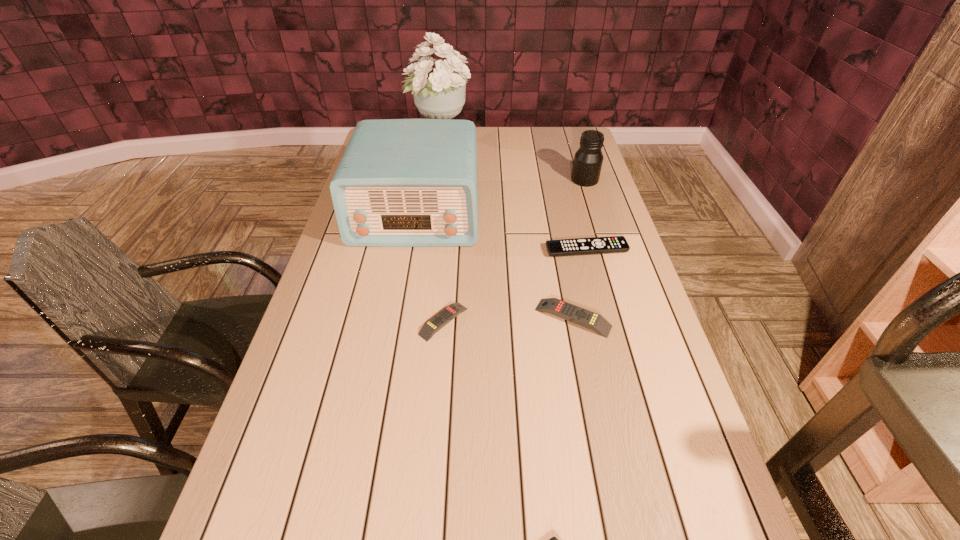
Locate an element on the screen. vacant point that satisfies the following two spatial constraints: 1. on the front panel of the bigger yellow remote control; 2. on the right side of the sixth shortest object is located at coordinates (398, 318).

Where is `free region that satisfies the following two spatial constraints: 1. on the front side of the farthest remote control; 2. on the left side of the green bouquet`? free region that satisfies the following two spatial constraints: 1. on the front side of the farthest remote control; 2. on the left side of the green bouquet is located at coordinates pyautogui.click(x=425, y=249).

Where is `vacant region that satisfies the following two spatial constraints: 1. on the front panel of the right yellow remote control; 2. on the left side of the second tallest object`? vacant region that satisfies the following two spatial constraints: 1. on the front panel of the right yellow remote control; 2. on the left side of the second tallest object is located at coordinates (398, 318).